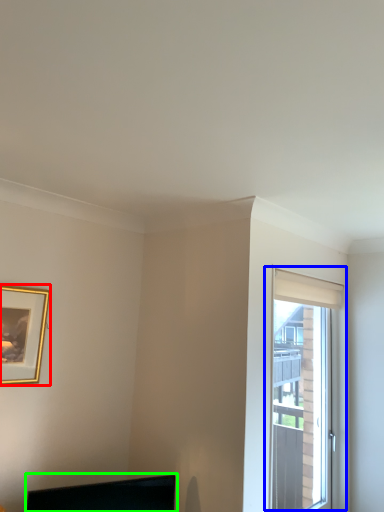
Question: Considering the real-world distances, which object is farthest from picture frame (highlighted by a red box)? window (highlighted by a blue box) or computer monitor (highlighted by a green box)?

Choices:
 (A) window
 (B) computer monitor

Answer: (A)